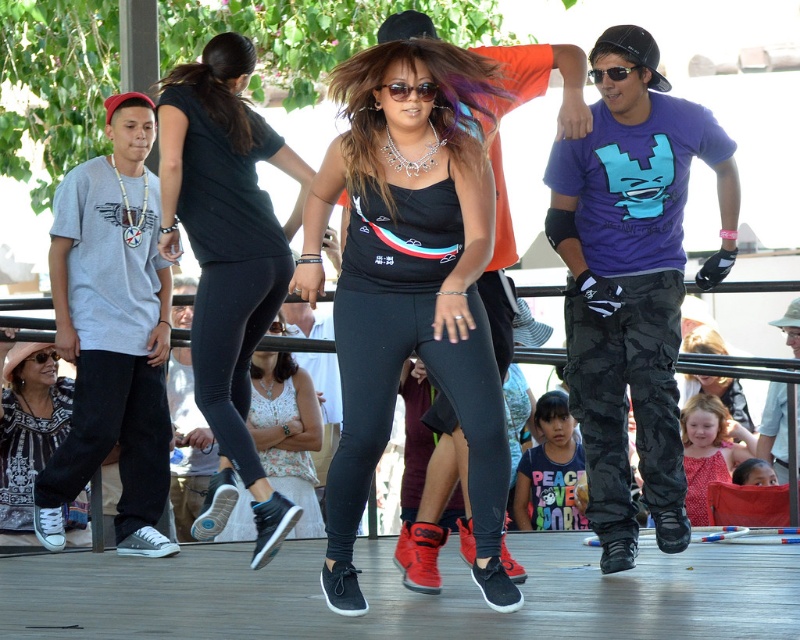
You are a photographer standing at the back of the stage. You want to take a photo of the central dancer. The camera can focus on objects within 5 feet. Will both the black matte tank top at center and the black leggings at center be in focus?

The black matte tank top at center is 6.15 feet away from the black leggings at center. Since the camera can only focus within 5 feet, the distance between them exceeds the focus range. Therefore, both items may not be in focus simultaneously.

You are a costume designer observing the dance performance. You need to ensure that the dancer at the center has appropriate clothing layers. Which clothing item, the black matte tank top at center or the black matte leggings at center, is positioned higher on her body?

The black matte tank top at center is much taller as the black matte leggings at center, so the tank top is positioned higher on her body.